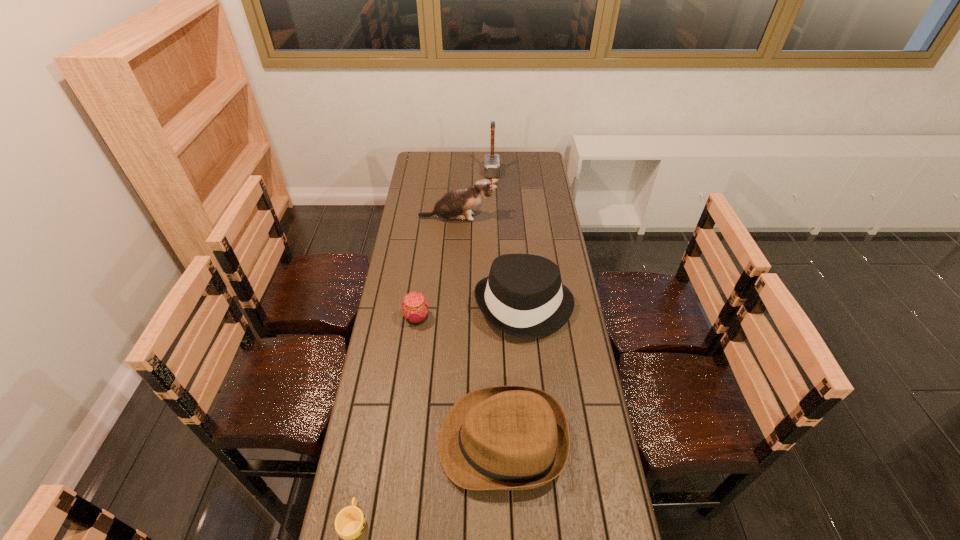
The height and width of the screenshot is (540, 960). I want to click on hammer, so [x=491, y=161].

Locate an element on the screen. This screenshot has height=540, width=960. the tallest object is located at coordinates (491, 161).

Identify the location of cat. (457, 204).

Locate an element on the screen. the farther fedora is located at coordinates (523, 296).

Find the location of a particular element. The height and width of the screenshot is (540, 960). the nearer fedora is located at coordinates (505, 437).

Locate an element on the screen. the fourth tallest object is located at coordinates (505, 437).

Locate an element on the screen. the second shortest object is located at coordinates (415, 307).

Find the location of a particular element. The width and height of the screenshot is (960, 540). blank space located 0.120m on the striking surface of the hammer is located at coordinates (462, 172).

Identify the location of vacant position located on the striking surface of the hammer. Image resolution: width=960 pixels, height=540 pixels. (453, 172).

Locate an element on the screen. The width and height of the screenshot is (960, 540). free spot located 0.120m on the striking surface of the hammer is located at coordinates (462, 172).